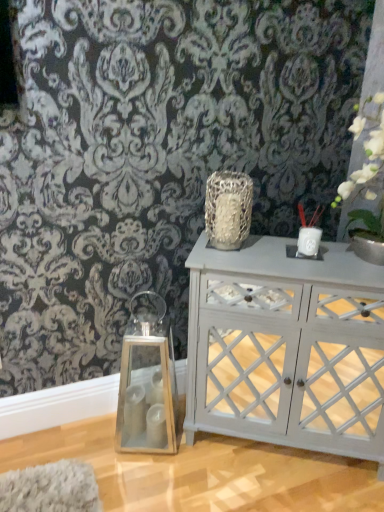
The image size is (384, 512). In order to click on vacant area that is in front of clear glass lantern at left, which is counted as the first candle holder, starting from the bottom in this screenshot , I will do `click(145, 485)`.